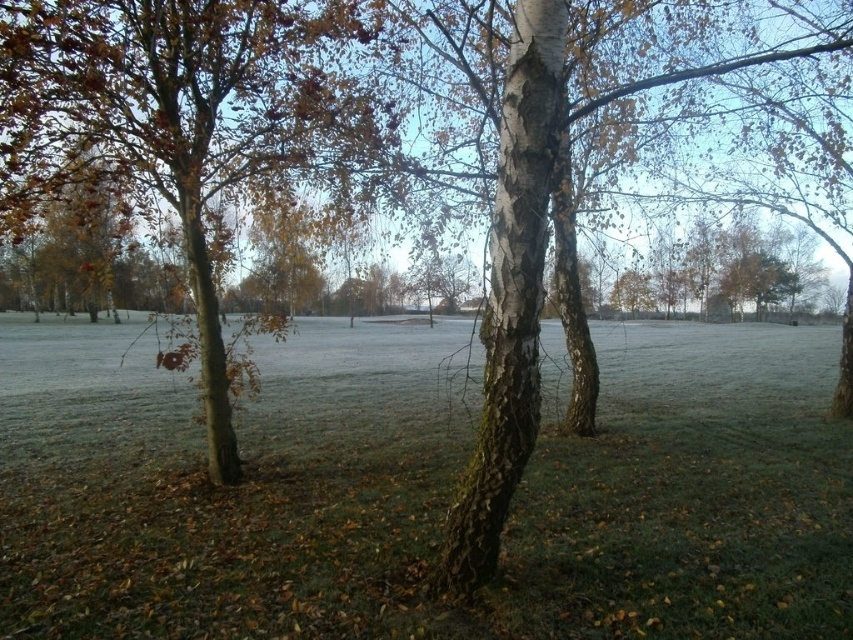
Question: Does green grass at center have a larger size compared to brown rough bark tree at left?

Choices:
 (A) yes
 (B) no

Answer: (A)

Question: Can you confirm if green grass at center is positioned to the left of brown rough bark tree at left?

Choices:
 (A) no
 (B) yes

Answer: (B)

Question: Does green grass at center appear over brown rough bark tree at left?

Choices:
 (A) no
 (B) yes

Answer: (A)

Question: Among these objects, which one is nearest to the camera?

Choices:
 (A) brown rough bark tree at left
 (B) green grass at center

Answer: (B)

Question: Which point is closer to the camera?

Choices:
 (A) (242, 561)
 (B) (38, 17)

Answer: (A)

Question: Which point appears closest to the camera in this image?

Choices:
 (A) (538, 502)
 (B) (366, 145)

Answer: (A)